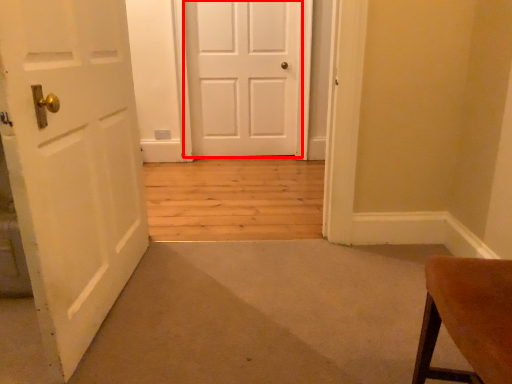
Question: From the image's perspective, what is the correct spatial relationship of door (annotated by the red box) in relation to door?

Choices:
 (A) above
 (B) below

Answer: (A)